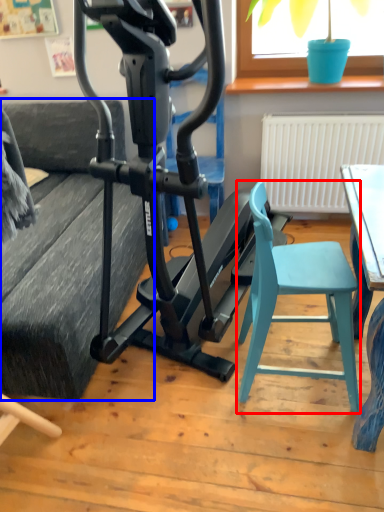
Question: Which point is closer to the camera, folding chair (highlighted by a red box) or couch (highlighted by a blue box)?

Choices:
 (A) folding chair
 (B) couch

Answer: (A)